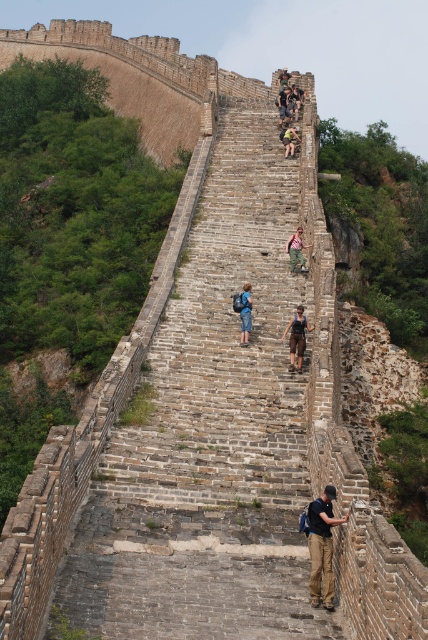
Who is lower down, brown leather backpack at center or dark blue jeans at center?

brown leather backpack at center is below.

Which is behind, point (294, 266) or point (279, 104)?

Point (279, 104)

What are the coordinates of `brown leather backpack at center` in the screenshot? It's located at (296, 250).

Which is below, brown leather backpack at center or blue denim jeans at center?

blue denim jeans at center is lower down.

Measure the distance from brown leather backpack at center to blue denim jeans at center.

brown leather backpack at center and blue denim jeans at center are 8.77 meters apart from each other.

Who is more distant from viewer, (x=297, y=228) or (x=246, y=340)?

The point (x=297, y=228) is more distant.

This screenshot has height=640, width=428. In order to click on brown leather backpack at center in this screenshot , I will do `click(296, 250)`.

Does point (249, 300) come behind point (285, 106)?

That is False.

Who is taller, blue denim jeans at center or dark blue jeans at center?

dark blue jeans at center is taller.

Which is in front, point (241, 344) or point (278, 100)?

Point (241, 344) is in front.

The width and height of the screenshot is (428, 640). In order to click on blue denim jeans at center in this screenshot , I will do `click(246, 314)`.